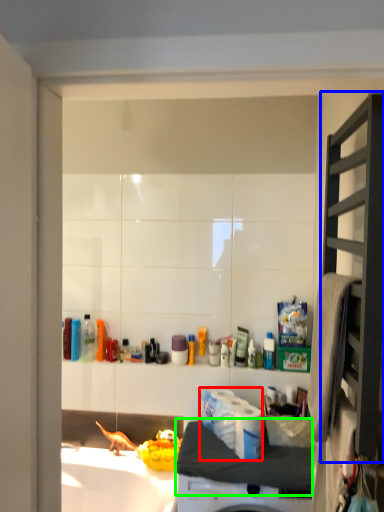
Question: Which object is the closest to the toilet paper (highlighted by a red box)? Choose among these: shelf (highlighted by a blue box) or counter top (highlighted by a green box).

Choices:
 (A) shelf
 (B) counter top

Answer: (B)